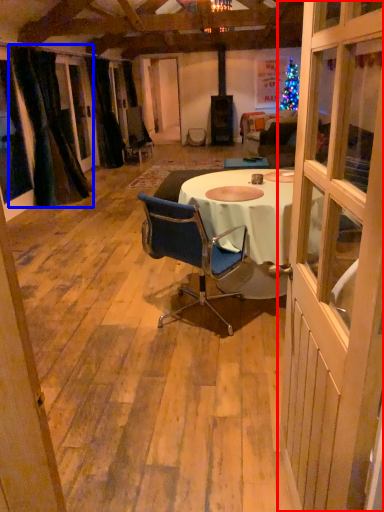
Question: Which of the following is the closest to the observer, door (highlighted by a red box) or curtain (highlighted by a blue box)?

Choices:
 (A) door
 (B) curtain

Answer: (A)